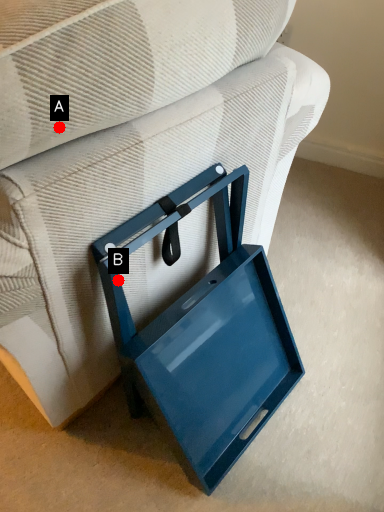
Question: Two points are circled on the image, labeled by A and B beside each circle. Which point appears closest to the camera in this image?

Choices:
 (A) A is closer
 (B) B is closer

Answer: (A)